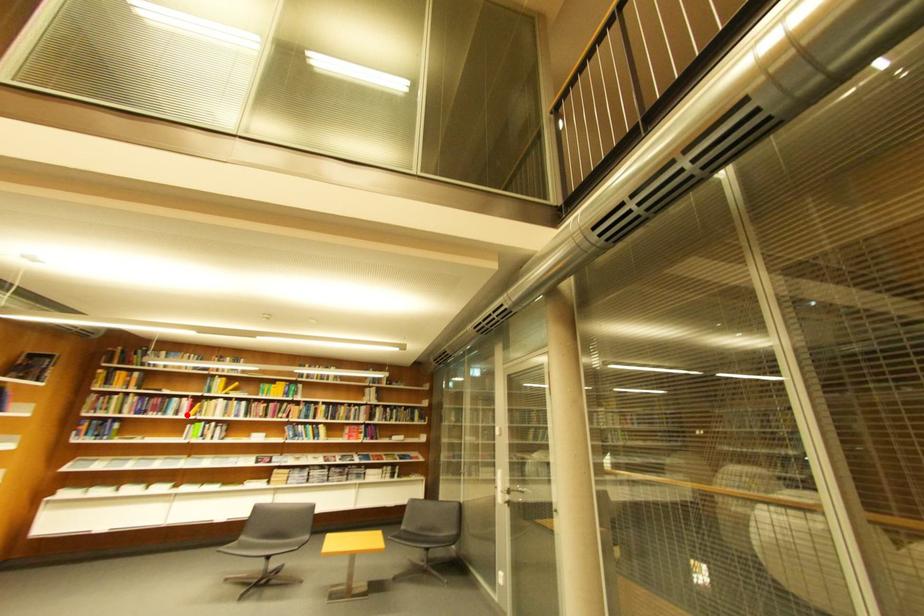
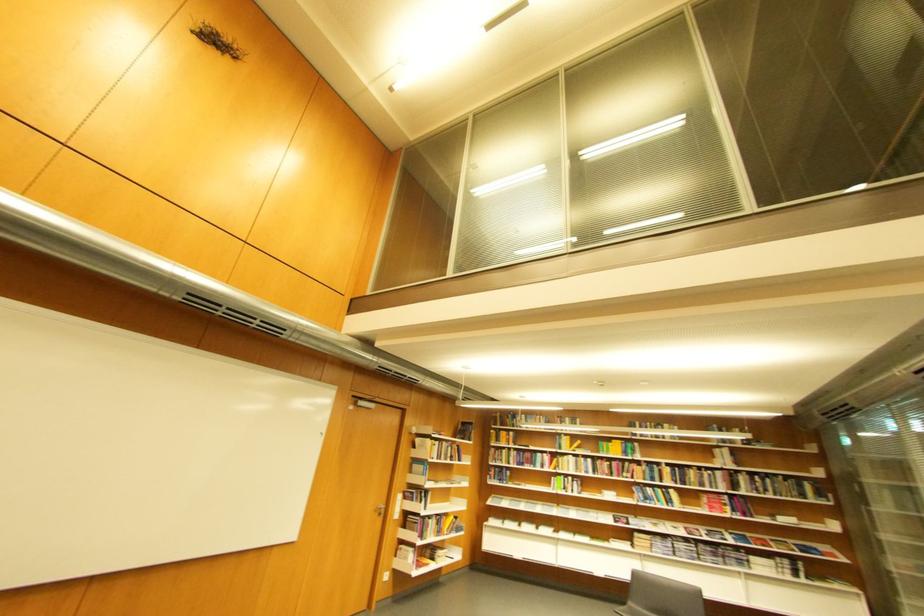
Question: I am providing you with two images of the same scene from different viewpoints. Given a red point in image1, look at the same physical point in image2. Is it:

Choices:
 (A) Closer to the viewpoint
 (B) Farther from the viewpoint

Answer: (B)